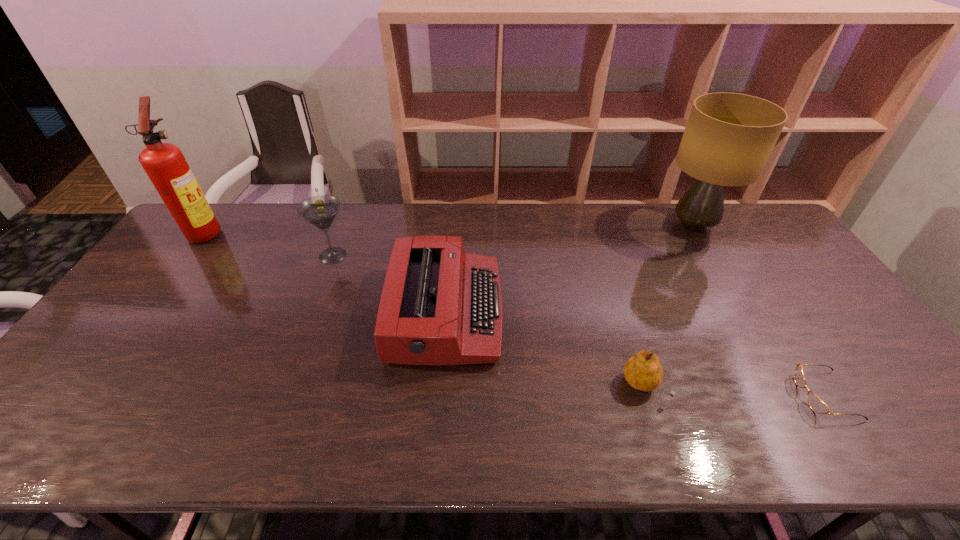
Where is `blank space located on the typing side of the fourth object from right to left`? The width and height of the screenshot is (960, 540). blank space located on the typing side of the fourth object from right to left is located at coordinates (569, 312).

Image resolution: width=960 pixels, height=540 pixels. Find the location of `free space located on the right of the pear`. free space located on the right of the pear is located at coordinates (706, 387).

Find the location of a particular element. vacant space located on the front-facing side of the shortest object is located at coordinates (661, 395).

Locate an element on the screen. vacant space located 0.240m on the front-facing side of the shortest object is located at coordinates (700, 395).

This screenshot has height=540, width=960. What are the coordinates of `blank space located on the front-facing side of the shortest object` in the screenshot? It's located at (666, 395).

What are the coordinates of `fire extinguisher that is at the far edge` in the screenshot? It's located at (164, 163).

Locate an element on the screen. The height and width of the screenshot is (540, 960). lampshade positioned at the far edge is located at coordinates (729, 137).

This screenshot has width=960, height=540. In order to click on martini at the far edge in this screenshot , I will do `click(321, 210)`.

You are a GUI agent. You are given a task and a screenshot of the screen. Output one action in this format:
    pyautogui.click(x=<x>, y=<y>)
    Task: Click on the object that is at the near edge
    
    Given the screenshot: What is the action you would take?
    pyautogui.click(x=816, y=404)

Image resolution: width=960 pixels, height=540 pixels. I want to click on object that is at the left edge, so click(164, 163).